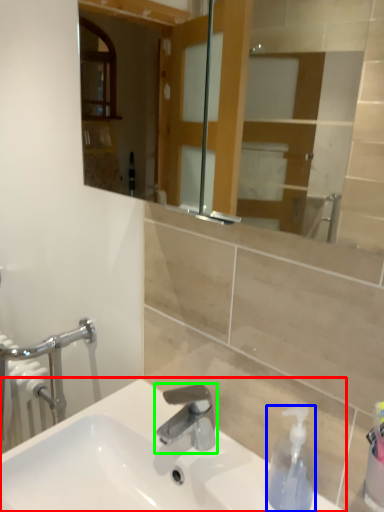
Question: Estimate the real-world distances between objects in this image. Which object is closer to sink (highlighted by a red box), soap dispenser (highlighted by a blue box) or tap (highlighted by a green box)?

Choices:
 (A) soap dispenser
 (B) tap

Answer: (B)